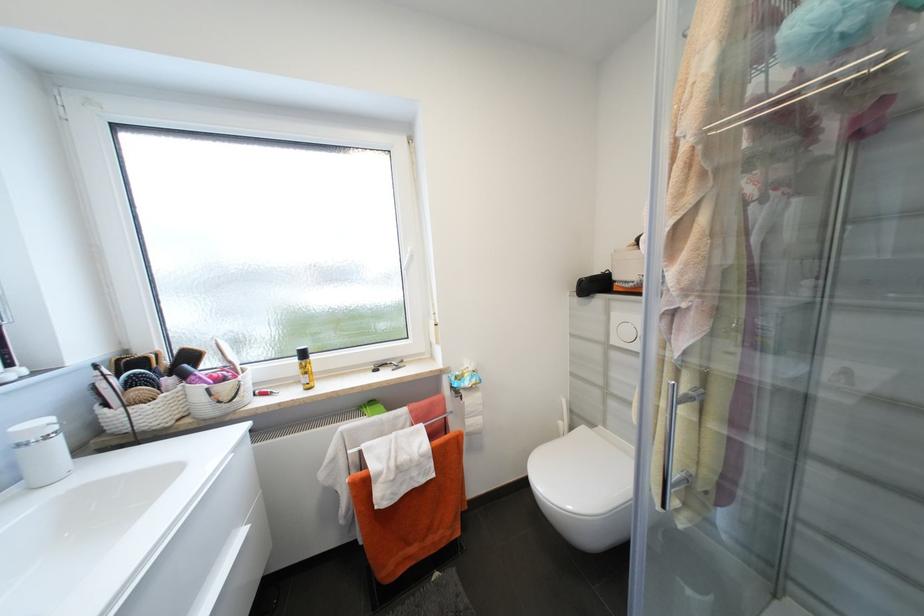
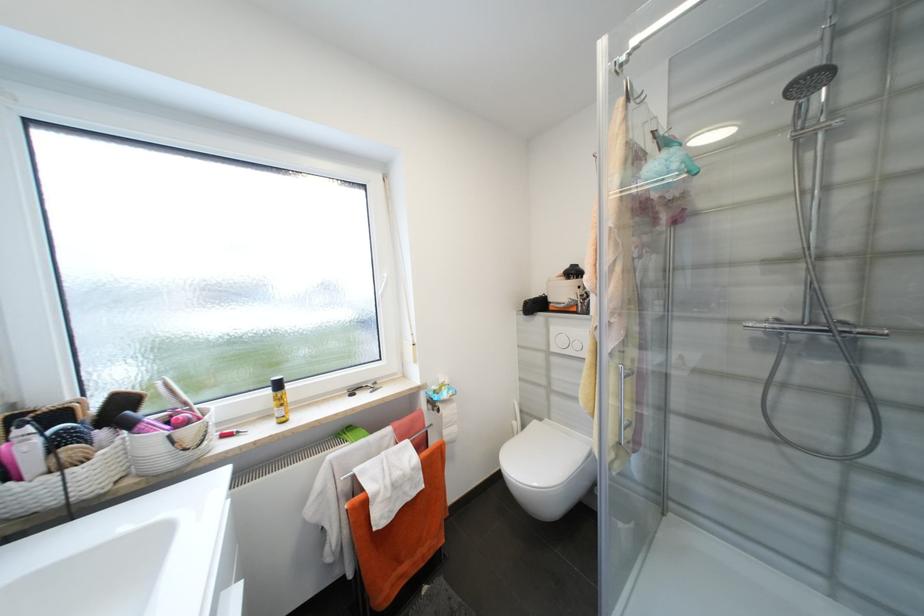
Where in the second image is the point corresponding to [190,377] from the first image?

(134, 427)